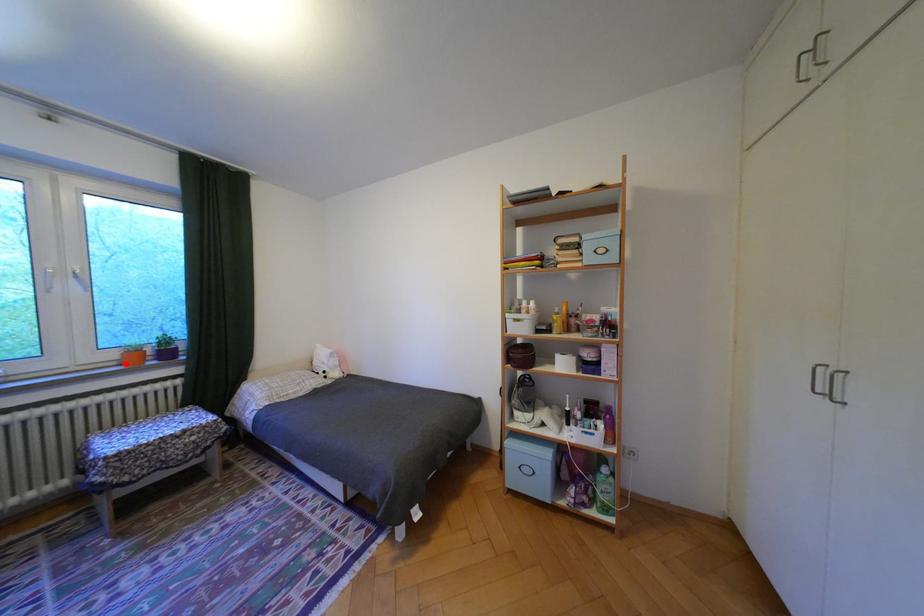
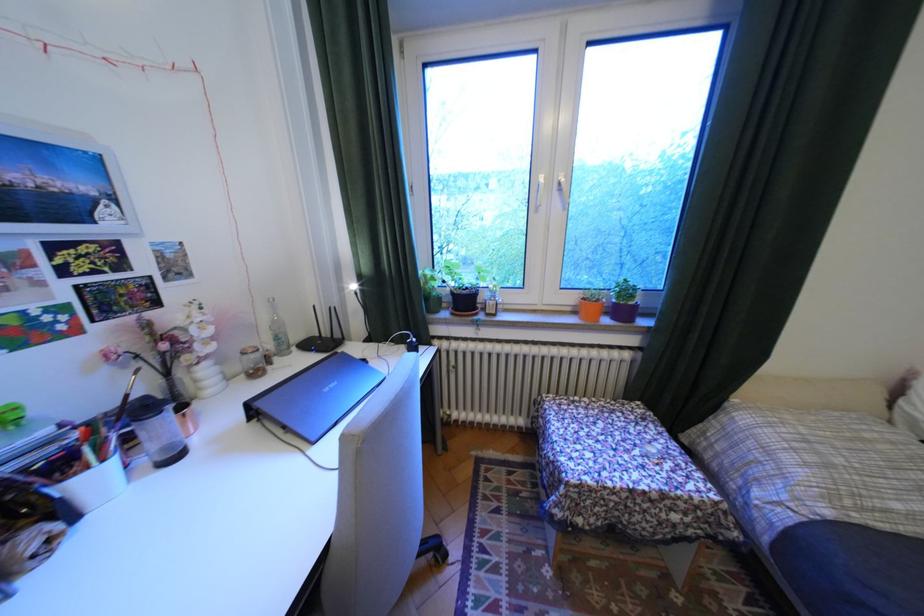
The point at the highlighted location is marked in the first image. Where is the corresponding point in the second image?

(580, 309)